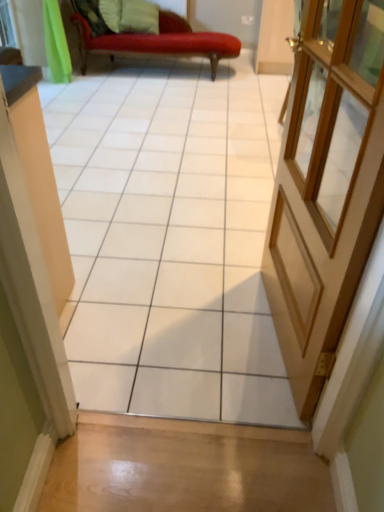
In order to face light brown wooden door at right, should I rotate leftwards or rightwards?

Rotate right and turn 14.676 degrees.

Identify the location of light brown wooden door at right. (318, 197).

Considering the relative sizes of light brown wooden door at right and green fabric pillow at upper center in the image provided, is light brown wooden door at right taller than green fabric pillow at upper center?

Yes.

Can you confirm if light brown wooden door at right is wider than green fabric pillow at upper center?

No, light brown wooden door at right is not wider than green fabric pillow at upper center.

Is light brown wooden door at right completely or partially outside of green fabric pillow at upper center?

Yes, light brown wooden door at right is not within green fabric pillow at upper center.

Locate an element on the screen. pillow on the left of light brown wooden door at right is located at coordinates click(139, 17).

Is light brown wooden door at right facing away from white glossy tile at center?

No, white glossy tile at center is not at the back of light brown wooden door at right.

Can you tell me how much light brown wooden door at right and white glossy tile at center differ in facing direction?

95.2 degrees.

Considering the relative sizes of light brown wooden door at right and white glossy tile at center in the image provided, is light brown wooden door at right bigger than white glossy tile at center?

Incorrect, light brown wooden door at right is not larger than white glossy tile at center.

How distant is light brown wooden door at right from white glossy tile at center?

They are 92.37 centimeters apart.

Is point (175, 344) closer or farther from the camera than point (359, 222)?

Point (175, 344) appears to be farther away from the viewer than point (359, 222).

From a real-world perspective, is white glossy tile at center under light brown wooden door at right?

Incorrect, from a real-world perspective, white glossy tile at center is higher than light brown wooden door at right.

Does white glossy tile at center have a greater width compared to light brown wooden door at right?

Correct, the width of white glossy tile at center exceeds that of light brown wooden door at right.

Between white glossy tile at center and green fabric pillow at upper center, which one has more height?

Standing taller between the two is white glossy tile at center.

Is white glossy tile at center not near green fabric pillow at upper center?

That's right, there is a large distance between white glossy tile at center and green fabric pillow at upper center.

Which is more to the right, white glossy tile at center or green fabric pillow at upper center?

From the viewer's perspective, white glossy tile at center appears more on the right side.

Is white glossy tile at center positioned beyond the bounds of green fabric pillow at upper center?

Absolutely, white glossy tile at center is external to green fabric pillow at upper center.

From a real-world perspective, does green fabric pillow at upper center sit lower than white glossy tile at center?

Indeed, from a real-world perspective, green fabric pillow at upper center is positioned beneath white glossy tile at center.

Is green fabric pillow at upper center turned away from white glossy tile at center?

No.

Can white glossy tile at center be found inside green fabric pillow at upper center?

No.

Does point (148, 12) come behind point (381, 95)?

Yes, it is behind point (381, 95).

What are the coordinates of `door in front of the green fabric pillow at upper center` in the screenshot? It's located at (318, 197).

Does green fabric pillow at upper center have a greater width compared to light brown wooden door at right?

Yes.

Is green fabric pillow at upper center surrounding light brown wooden door at right?

That's incorrect, light brown wooden door at right is not inside green fabric pillow at upper center.

You are a GUI agent. You are given a task and a screenshot of the screen. Output one action in this format:
    pyautogui.click(x=<x>, y=<y>)
    Task: Click on the door above the green fabric pillow at upper center (from a real-world perspective)
    The image size is (384, 512).
    Given the screenshot: What is the action you would take?
    pyautogui.click(x=318, y=197)

Where is `door below the white glossy tile at center (from a real-world perspective)`? The image size is (384, 512). door below the white glossy tile at center (from a real-world perspective) is located at coordinates (318, 197).

Considering their positions, is light brown wooden door at right positioned closer to white glossy tile at center than green fabric pillow at upper center?

The object closer to white glossy tile at center is light brown wooden door at right.

From the image, which object appears to be farther from green fabric pillow at upper center, light brown wooden door at right or white glossy tile at center?

Based on the image, light brown wooden door at right appears to be further to green fabric pillow at upper center.

Based on their spatial positions, is green fabric pillow at upper center or white glossy tile at center closer to light brown wooden door at right?

The object closer to light brown wooden door at right is white glossy tile at center.

From the image, which object appears to be nearer to light brown wooden door at right, white glossy tile at center or green fabric pillow at upper center?

white glossy tile at center lies closer to light brown wooden door at right than the other object.

Based on their spatial positions, is green fabric pillow at upper center or light brown wooden door at right further from white glossy tile at center?

Among the two, green fabric pillow at upper center is located further to white glossy tile at center.

When comparing their distances from green fabric pillow at upper center, does white glossy tile at center or light brown wooden door at right seem closer?

The object closer to green fabric pillow at upper center is white glossy tile at center.

I want to click on door between white glossy tile at center and green fabric pillow at upper center from front to back, so click(318, 197).